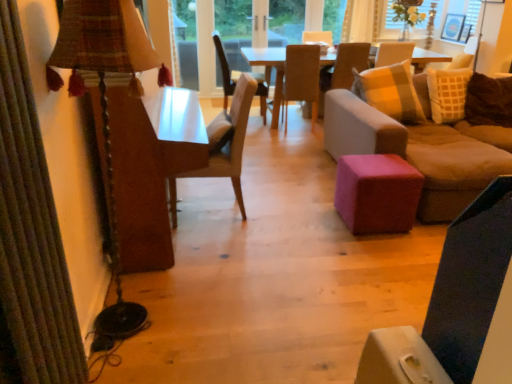
What do you see at coordinates (421, 149) in the screenshot? Image resolution: width=512 pixels, height=384 pixels. I see `pink fabric ottoman at center` at bounding box center [421, 149].

What do you see at coordinates (448, 13) in the screenshot? I see `white fabric at upper right` at bounding box center [448, 13].

Where is `white sheer curtain at upper center`? white sheer curtain at upper center is located at coordinates (360, 21).

This screenshot has height=384, width=512. What do you see at coordinates (377, 193) in the screenshot?
I see `pink fabric ottoman at center` at bounding box center [377, 193].

Measure the distance between brown fabric chair at center, which ranks as the third chair in left-to-right order, and camera.

The depth of brown fabric chair at center, which ranks as the third chair in left-to-right order, is 14.98 feet.

This screenshot has width=512, height=384. What do you see at coordinates (489, 101) in the screenshot? I see `woven fabric pillow at right` at bounding box center [489, 101].

Locate an element on the screen. light brown wooden table at center is located at coordinates (270, 66).

The height and width of the screenshot is (384, 512). I want to click on pink fabric ottoman at center, so click(421, 149).

How different are the orientations of pink fabric ottoman at center and pink fabric ottoman at center in degrees?

There is a 87.5-degree angle between the facing directions of pink fabric ottoman at center and pink fabric ottoman at center.

Could you tell me if pink fabric ottoman at center is turned towards pink fabric ottoman at center?

No, pink fabric ottoman at center is not facing towards pink fabric ottoman at center.

Is pink fabric ottoman at center in contact with pink fabric ottoman at center?

No.

Is pink fabric ottoman at center located within pink fabric ottoman at center?

Indeed, pink fabric ottoman at center is located within pink fabric ottoman at center.

Considering the relative sizes of light brown wooden chair at center, marked as the 2th chair in a back-to-front arrangement, and light brown wooden table at center in the image provided, is light brown wooden chair at center, marked as the 2th chair in a back-to-front arrangement, shorter than light brown wooden table at center?

Incorrect, the height of light brown wooden chair at center, marked as the 2th chair in a back-to-front arrangement, does not fall short of that of light brown wooden table at center.

Does light brown wooden chair at center, which is the fourth chair in left-to-right order, have a larger size compared to light brown wooden table at center?

Actually, light brown wooden chair at center, which is the fourth chair in left-to-right order, might be smaller than light brown wooden table at center.

What are the coordinates of `table behind the light brown wooden chair at center, which is the fourth chair in left-to-right order` in the screenshot? It's located at (270, 66).

Visually, is light brown wooden chair at center, marked as the 2th chair in a back-to-front arrangement, positioned to the left or to the right of light brown wooden table at center?

Based on their positions, light brown wooden chair at center, marked as the 2th chair in a back-to-front arrangement, is located to the left of light brown wooden table at center.

Find the location of `pillow that appears above the pink fabric ottoman at center (from a real-world perspective)`. pillow that appears above the pink fabric ottoman at center (from a real-world perspective) is located at coordinates (489, 101).

Is woven fabric pillow at right to the right of pink fabric ottoman at center from the viewer's perspective?

Indeed, woven fabric pillow at right is positioned on the right side of pink fabric ottoman at center.

Is woven fabric pillow at right far away from pink fabric ottoman at center?

Yes, woven fabric pillow at right and pink fabric ottoman at center are located far from each other.

How many degrees apart are the facing directions of woven fabric pillow at right and pink fabric ottoman at center?

The angle between the facing direction of woven fabric pillow at right and the facing direction of pink fabric ottoman at center is 88.9 degrees.

Can we say white sheer curtain at upper center lies outside wooden chair at center, placed as the first chair when sorted from front to back?

Yes, white sheer curtain at upper center is located beyond the bounds of wooden chair at center, placed as the first chair when sorted from front to back.

Does white sheer curtain at upper center appear on the left side of wooden chair at center, the first chair viewed from the left?

Incorrect, white sheer curtain at upper center is not on the left side of wooden chair at center, the first chair viewed from the left.

Can you confirm if white sheer curtain at upper center is shorter than textured fabric lampshade at left?

Yes.

Is white sheer curtain at upper center oriented away from textured fabric lampshade at left?

white sheer curtain at upper center is not turned away from textured fabric lampshade at left.

Is white sheer curtain at upper center wider than textured fabric lampshade at left?

In fact, white sheer curtain at upper center might be narrower than textured fabric lampshade at left.

Is pink fabric ottoman at center positioned beyond the bounds of woven fabric pillow at right?

pink fabric ottoman at center lies outside woven fabric pillow at right's area.

From a real-world perspective, is pink fabric ottoman at center positioned under woven fabric pillow at right based on gravity?

Yes, from a real-world perspective, pink fabric ottoman at center is under woven fabric pillow at right.

What's the angular difference between pink fabric ottoman at center and woven fabric pillow at right's facing directions?

They differ by 1.37 degrees in their facing directions.

Is wooden chair at center, positioned as the third chair in right-to-left order, at the right side of pink fabric ottoman at center?

Incorrect, wooden chair at center, positioned as the third chair in right-to-left order, is not on the right side of pink fabric ottoman at center.

How different are the orientations of wooden chair at center, positioned as the third chair in right-to-left order, and pink fabric ottoman at center in degrees?

The angular difference between wooden chair at center, positioned as the third chair in right-to-left order, and pink fabric ottoman at center is 2.68 degrees.

Locate an element on the screen. This screenshot has width=512, height=384. the 4th chair above the pink fabric ottoman at center (from the image's perspective) is located at coordinates (225, 70).

Considering the positions of objects wooden chair at center, which is counted as the 2th chair, starting from the left, and pink fabric ottoman at center in the image provided, who is in front, wooden chair at center, which is counted as the 2th chair, starting from the left, or pink fabric ottoman at center?

Positioned in front is pink fabric ottoman at center.

The width and height of the screenshot is (512, 384). Identify the location of stool below the pink fabric ottoman at center (from the image's perspective). (377, 193).

In order to click on chair that is the 4th object above the light brown wooden table at center (from a real-world perspective) in this screenshot , I will do `click(343, 69)`.

Looking at the image, which one is located closer to light brown wooden chair at center, which is the fourth chair in left-to-right order, wooden chair at center, the first chair viewed from the left, or white glass window frame at center?

white glass window frame at center is closer to light brown wooden chair at center, which is the fourth chair in left-to-right order.

Estimate the real-world distances between objects in this image. Which object is further from woven fabric pillow at right, brown fabric chair at center, the second chair viewed from the right, or wooden chair at center, the first chair when ordered from back to front?

Among the two, wooden chair at center, the first chair when ordered from back to front, is located further to woven fabric pillow at right.

When comparing their distances from white fabric at upper right, does pink fabric ottoman at center or wooden chair at center, the 4th chair positioned from the back, seem further?

The object further to white fabric at upper right is wooden chair at center, the 4th chair positioned from the back.

Estimate the real-world distances between objects in this image. Which object is further from white sheer curtain at upper center, brown fabric chair at center, the second chair viewed from the right, or pink fabric ottoman at center?

pink fabric ottoman at center is positioned further to the anchor white sheer curtain at upper center.

Based on their spatial positions, is brown fabric chair at center, the second chair viewed from the right, or white fabric at upper right closer to pink fabric ottoman at center?

Among the two, brown fabric chair at center, the second chair viewed from the right, is located nearer to pink fabric ottoman at center.

From the image, which object appears to be nearer to woven fabric pillow at right, textured fabric lampshade at left or wooden chair at center, arranged as the 4th chair when viewed from the right?

wooden chair at center, arranged as the 4th chair when viewed from the right, lies closer to woven fabric pillow at right than the other object.

Estimate the real-world distances between objects in this image. Which object is closer to brown fabric chair at center, the 2th chair from the front, textured fabric lampshade at left or white glass window frame at center?

Among the two, white glass window frame at center is located nearer to brown fabric chair at center, the 2th chair from the front.

Estimate the real-world distances between objects in this image. Which object is further from wooden chair at center, positioned as the third chair in right-to-left order, pink fabric ottoman at center or pink fabric ottoman at center?

pink fabric ottoman at center is positioned further to the anchor wooden chair at center, positioned as the third chair in right-to-left order.

This screenshot has height=384, width=512. I want to click on curtain situated between white glass window frame at center and white fabric at upper right from left to right, so click(360, 21).

Where is `pillow located between pink fabric ottoman at center and white glass window frame at center in the depth direction`? This screenshot has width=512, height=384. pillow located between pink fabric ottoman at center and white glass window frame at center in the depth direction is located at coordinates (489, 101).

The width and height of the screenshot is (512, 384). I want to click on chair between textured fabric lampshade at left and brown fabric chair at center, the second chair viewed from the right, in the front-back direction, so click(225, 145).

Locate an element on the screen. The width and height of the screenshot is (512, 384). stool located between textured fabric lampshade at left and pink fabric ottoman at center in the left-right direction is located at coordinates (377, 193).